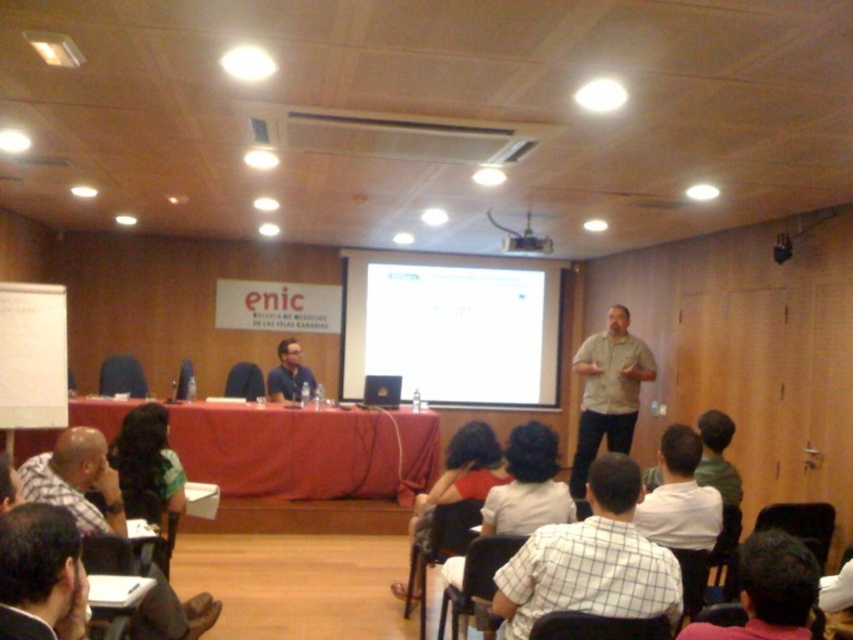
Does white checkered shirt at center have a lesser width compared to dark brown hair at center?

In fact, white checkered shirt at center might be wider than dark brown hair at center.

Between point (497, 576) and point (463, 467), which one is positioned behind?

The point (463, 467) is more distant.

Does point (642, 589) come farther from viewer compared to point (439, 474)?

That is False.

At what (x,y) coordinates should I click in order to perform the action: click on white checkered shirt at center. Please return your answer as a coordinate pair (x, y). Looking at the image, I should click on (590, 561).

Does striped cotton shirt at center have a greater width compared to black plastic projector at upper center?

Yes.

At what (x,y) coordinates should I click in order to perform the action: click on striped cotton shirt at center. Please return your answer as a coordinate pair (x, y). Image resolution: width=853 pixels, height=640 pixels. Looking at the image, I should click on (608, 392).

You are a GUI agent. You are given a task and a screenshot of the screen. Output one action in this format:
    pyautogui.click(x=<x>, y=<y>)
    Task: Click on the striped cotton shirt at center
    The height and width of the screenshot is (640, 853).
    Given the screenshot: What is the action you would take?
    pyautogui.click(x=608, y=392)

Does dark brown hair at lower right appear over black plastic projector at upper center?

Incorrect, dark brown hair at lower right is not positioned above black plastic projector at upper center.

Can you confirm if dark brown hair at lower right is taller than black plastic projector at upper center?

Indeed, dark brown hair at lower right has a greater height compared to black plastic projector at upper center.

Between point (810, 573) and point (521, 244), which one is positioned behind?

The point (521, 244) is behind.

Locate an element on the screen. The height and width of the screenshot is (640, 853). dark brown hair at lower right is located at coordinates tap(769, 589).